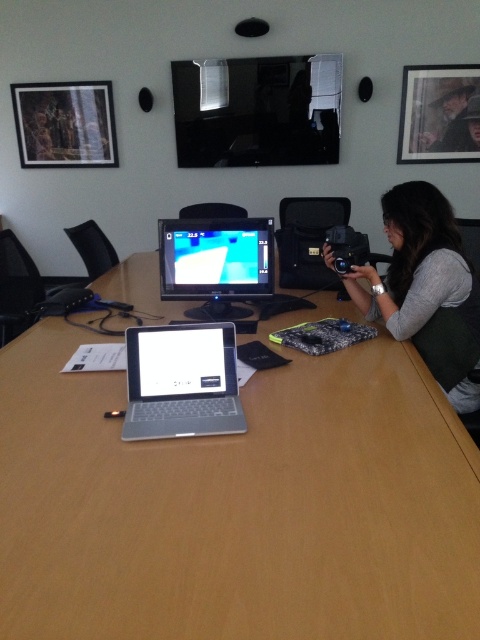
Question: Can you confirm if matte black monitor at center is positioned to the left of matte black camera at upper right?

Choices:
 (A) no
 (B) yes

Answer: (B)

Question: Does wooden table at center have a smaller size compared to matte black camera at upper right?

Choices:
 (A) yes
 (B) no

Answer: (B)

Question: Can you confirm if matte black monitor at center is smaller than matte black camera at upper right?

Choices:
 (A) no
 (B) yes

Answer: (A)

Question: Which point is farther to the camera?

Choices:
 (A) (201, 464)
 (B) (164, 332)
 (C) (459, 392)

Answer: (C)

Question: Which of the following is the farthest from the observer?

Choices:
 (A) matte black monitor at center
 (B) matte black camera at upper right

Answer: (B)

Question: Which of the following is the closest to the observer?

Choices:
 (A) (458, 122)
 (B) (235, 406)
 (C) (408, 289)
 (D) (225, 317)

Answer: (B)